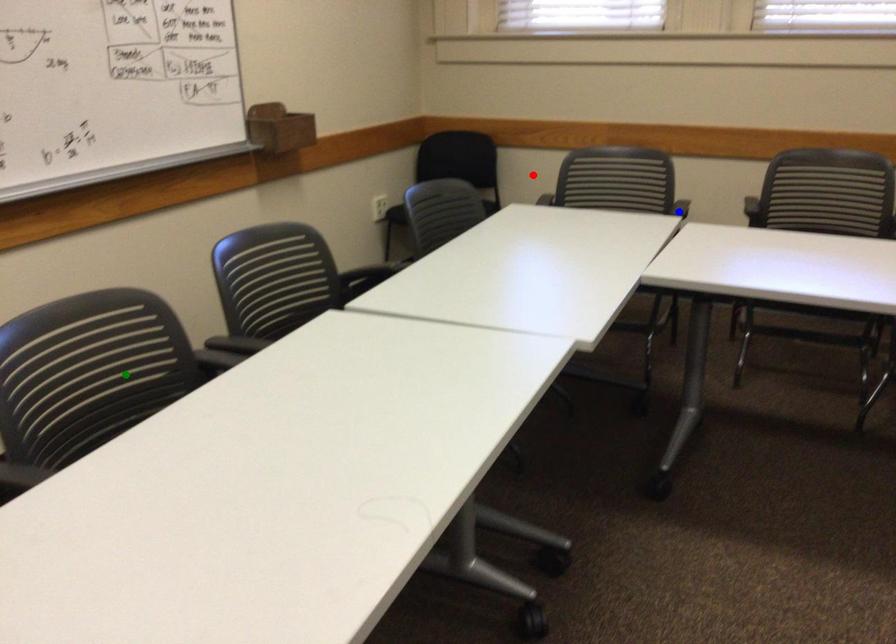
Order these from nearest to farthest:
red point
green point
blue point

green point
blue point
red point